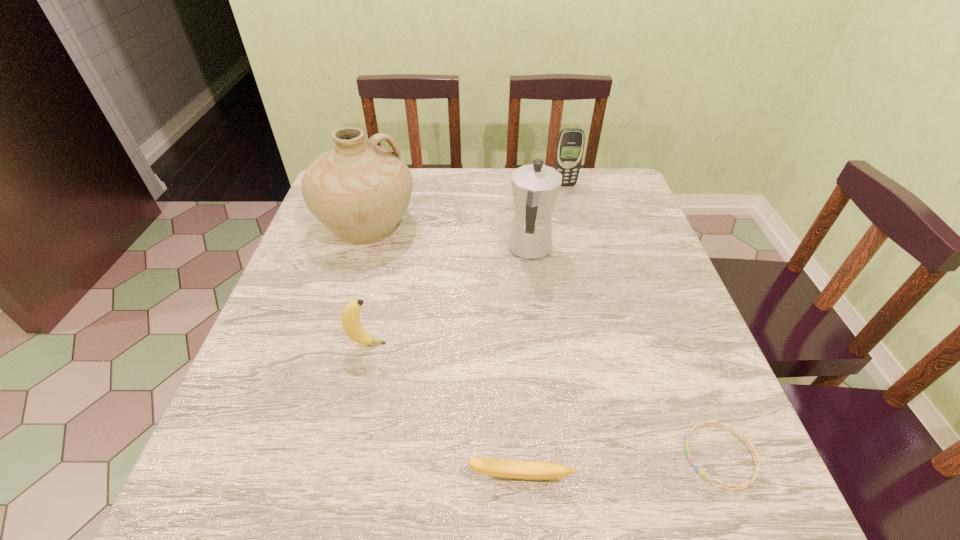
The image size is (960, 540). I want to click on pottery, so click(x=359, y=191).

Locate an element on the screen. Image resolution: width=960 pixels, height=540 pixels. coffeepot is located at coordinates (535, 187).

Image resolution: width=960 pixels, height=540 pixels. Find the location of `cellular telephone`. cellular telephone is located at coordinates (570, 145).

You are a GUI agent. You are given a task and a screenshot of the screen. Output one action in this format:
    pyautogui.click(x=<x>, y=<y>)
    Task: Click on the farthest object
    Image resolution: width=960 pixels, height=540 pixels.
    Given the screenshot: What is the action you would take?
    pyautogui.click(x=570, y=145)

In order to click on the farther banana in this screenshot , I will do `click(352, 326)`.

You are a GUI agent. You are given a task and a screenshot of the screen. Output one action in this format:
    pyautogui.click(x=<x>, y=<y>)
    Task: Click on the fourth farthest object
    
    Given the screenshot: What is the action you would take?
    pyautogui.click(x=352, y=326)

The image size is (960, 540). Find the location of `the right banana`. the right banana is located at coordinates (517, 469).

Where is `the shorter banana`? Image resolution: width=960 pixels, height=540 pixels. the shorter banana is located at coordinates (517, 469).

At what (x,y) coordinates should I click in order to perform the action: click on bracelet. Please return your answer as a coordinate pair (x, y). Image resolution: width=960 pixels, height=540 pixels. Looking at the image, I should click on (757, 467).

Find the location of `the rightmost object`. the rightmost object is located at coordinates (757, 467).